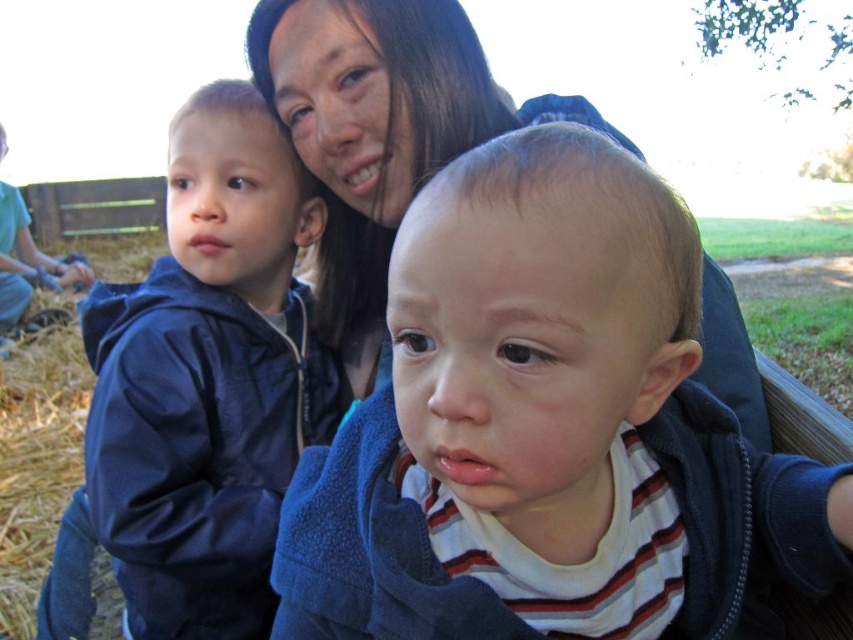
Question: Which object is farther from the camera taking this photo?

Choices:
 (A) smooth dark hair at center
 (B) matte blue hoodie at center
 (C) dark blue jacket at left

Answer: (C)

Question: Does matte blue hoodie at center come in front of smooth dark hair at center?

Choices:
 (A) no
 (B) yes

Answer: (B)

Question: Is dark blue jacket at left to the left of smooth dark hair at center from the viewer's perspective?

Choices:
 (A) yes
 (B) no

Answer: (A)

Question: Which is nearer to the dark blue jacket at left?

Choices:
 (A) smooth dark hair at center
 (B) matte blue hoodie at center

Answer: (A)

Question: Does matte blue hoodie at center have a smaller size compared to dark blue jacket at left?

Choices:
 (A) yes
 (B) no

Answer: (A)

Question: Which point is closer to the camera?

Choices:
 (A) smooth dark hair at center
 (B) dark blue jacket at left
 (C) matte blue hoodie at center

Answer: (C)